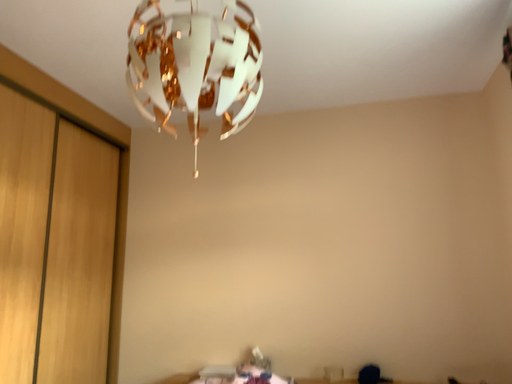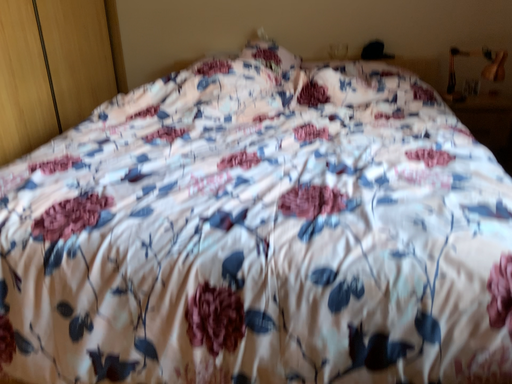
Question: Which way did the camera rotate in the video?

Choices:
 (A) rotated downward
 (B) rotated upward

Answer: (A)